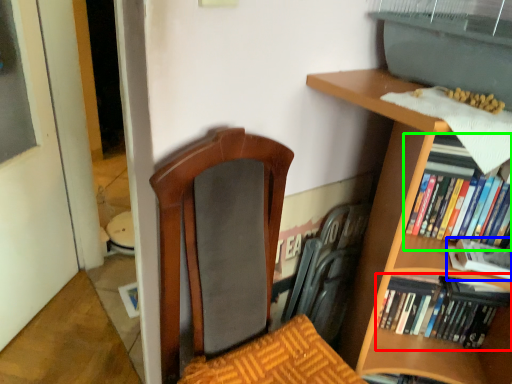
Question: Which is farther away from book (highlighted by a red box)? book (highlighted by a blue box) or book (highlighted by a green box)?

Choices:
 (A) book
 (B) book

Answer: (B)